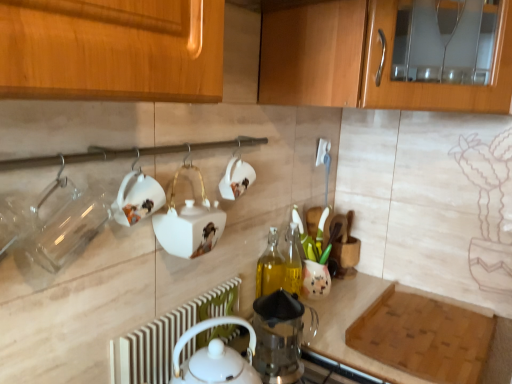
Question: Considering the positions of white glossy teapot at center, the first appliance in the left-to-right sequence, and white radiator at lower center in the image, is white glossy teapot at center, the first appliance in the left-to-right sequence, bigger or smaller than white radiator at lower center?

Choices:
 (A) small
 (B) big

Answer: (B)

Question: Relative to white radiator at lower center, is white glossy teapot at center, positioned as the second appliance in bottom-to-top order, in front or behind?

Choices:
 (A) behind
 (B) front

Answer: (B)

Question: Which is nearer to the white glossy teapot at upper center, the 2th tableware positioned from the right?

Choices:
 (A) matte ceramic tea set at center right, the 1th tea set in the back-to-front sequence
 (B) transparent glass coffee press at center, which is the first appliance in right-to-left order
 (C) white radiator at lower center
 (D) transparent glass jar at left, the 1th tableware positioned from the left
 (E) translucent glass bottle at center

Answer: (D)

Question: Based on their relative distances, which object is nearer to the white glossy teapot at lower center, positioned as the first tea set in left-to-right order?

Choices:
 (A) translucent glass bottle at center
 (B) matte ceramic tea set at center right, positioned as the 2th tea set in left-to-right order
 (C) white glossy cup at center, placed as the 1th tableware when sorted from back to front
 (D) white glossy teapot at center, the first appliance in the left-to-right sequence
 (E) white radiator at lower center

Answer: (E)